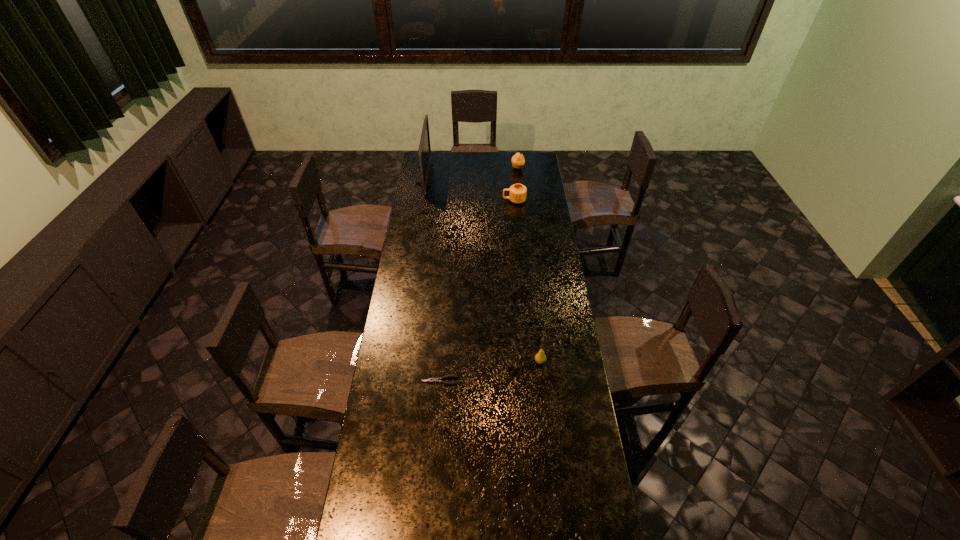
Find the location of `vacant space located 0.400m on the handle side of the mug`. vacant space located 0.400m on the handle side of the mug is located at coordinates (433, 200).

The image size is (960, 540). I want to click on vacant area situated 0.360m on the handle side of the mug, so click(x=440, y=200).

At what (x,y) coordinates should I click in order to perform the action: click on vacant area located on the handle side of the mug. Please return your answer as a coordinate pair (x, y). The height and width of the screenshot is (540, 960). Looking at the image, I should click on (465, 200).

This screenshot has height=540, width=960. What are the coordinates of `vacant area situated 0.160m on the front of the nearer pear` in the screenshot? It's located at (544, 404).

Find the location of a particular element. The image size is (960, 540). free region located 0.240m on the front of the pliers is located at coordinates (435, 447).

Where is `monitor located in the far edge section of the desktop`? The height and width of the screenshot is (540, 960). monitor located in the far edge section of the desktop is located at coordinates (424, 173).

Where is `pear present at the far edge`? The image size is (960, 540). pear present at the far edge is located at coordinates (518, 161).

Find the location of a particular element. Image resolution: width=960 pixels, height=540 pixels. monitor that is at the left edge is located at coordinates (424, 173).

This screenshot has height=540, width=960. I want to click on pliers at the left edge, so click(436, 380).

Find the location of `mug located at the right edge`. mug located at the right edge is located at coordinates (517, 193).